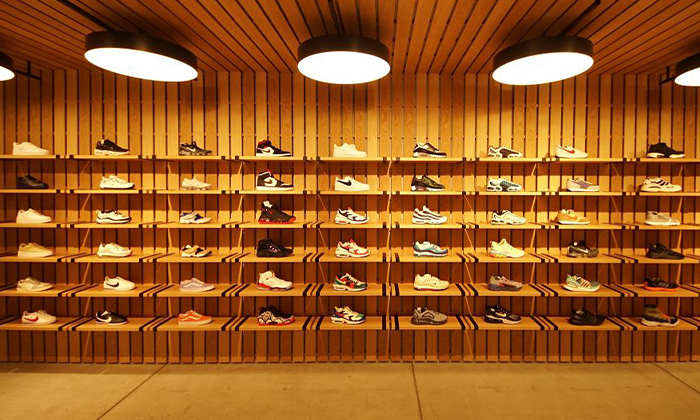
This screenshot has height=420, width=700. What are the coordinates of `ceiling lights` in the screenshot? It's located at (x=6, y=70), (x=127, y=53), (x=556, y=68), (x=687, y=75).